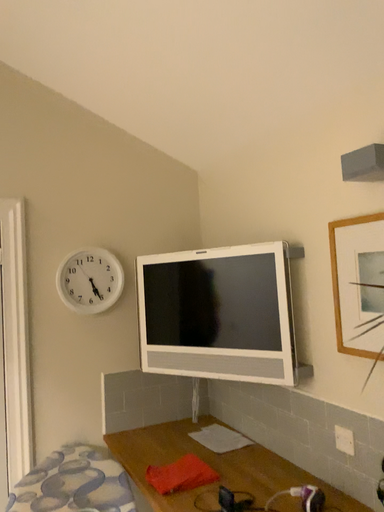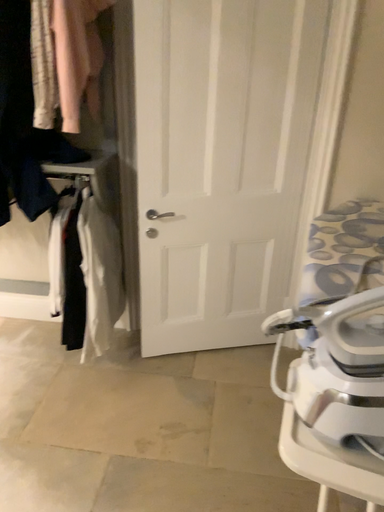
Question: How did the camera likely rotate when shooting the video?

Choices:
 (A) rotated right
 (B) rotated left

Answer: (B)